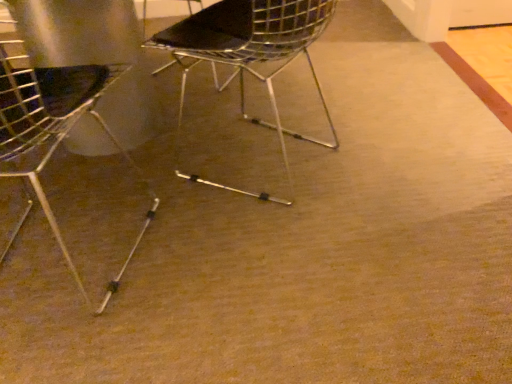
Question: In which direction should I rotate to look at metallic wire chair at center, the 1th chair from the right?

Choices:
 (A) left
 (B) right

Answer: (B)

Question: Does metallic wire chair at center, which is the second chair in left-to-right order, turn towards metallic wire chair at left, the first chair when ordered from left to right?

Choices:
 (A) yes
 (B) no

Answer: (B)

Question: Considering the relative sizes of metallic wire chair at center, which is the second chair in left-to-right order, and metallic wire chair at left, the second chair positioned from the right, in the image provided, is metallic wire chair at center, which is the second chair in left-to-right order, shorter than metallic wire chair at left, the second chair positioned from the right,?

Choices:
 (A) yes
 (B) no

Answer: (A)

Question: Is metallic wire chair at center, which is the second chair in left-to-right order, in front of metallic wire chair at left, the second chair positioned from the right?

Choices:
 (A) yes
 (B) no

Answer: (B)

Question: From a real-world perspective, is metallic wire chair at center, the 1th chair from the right, on metallic wire chair at left, the second chair positioned from the right?

Choices:
 (A) no
 (B) yes

Answer: (A)

Question: Can you confirm if metallic wire chair at center, which is the second chair in left-to-right order, is positioned to the right of metallic wire chair at left, the second chair positioned from the right?

Choices:
 (A) no
 (B) yes

Answer: (B)

Question: Considering the relative sizes of metallic wire chair at center, which is the second chair in left-to-right order, and metallic wire chair at left, the second chair positioned from the right, in the image provided, is metallic wire chair at center, which is the second chair in left-to-right order, bigger than metallic wire chair at left, the second chair positioned from the right,?

Choices:
 (A) no
 (B) yes

Answer: (A)

Question: Is metallic wire chair at left, the first chair when ordered from left to right, bigger than metallic wire chair at center, the 1th chair from the right?

Choices:
 (A) yes
 (B) no

Answer: (A)

Question: Could you tell me if metallic wire chair at left, the second chair positioned from the right, is facing metallic wire chair at center, the 1th chair from the right?

Choices:
 (A) no
 (B) yes

Answer: (A)

Question: From a real-world perspective, is metallic wire chair at left, the second chair positioned from the right, on top of metallic wire chair at center, the 1th chair from the right?

Choices:
 (A) yes
 (B) no

Answer: (A)

Question: Is metallic wire chair at center, which is the second chair in left-to-right order, inside metallic wire chair at left, the second chair positioned from the right?

Choices:
 (A) yes
 (B) no

Answer: (B)

Question: Considering the relative sizes of metallic wire chair at left, the second chair positioned from the right, and metallic wire chair at center, which is the second chair in left-to-right order, in the image provided, is metallic wire chair at left, the second chair positioned from the right, wider than metallic wire chair at center, which is the second chair in left-to-right order,?

Choices:
 (A) yes
 (B) no

Answer: (B)

Question: Considering the relative positions of metallic wire chair at left, the second chair positioned from the right, and metallic wire chair at center, the 1th chair from the right, in the image provided, is metallic wire chair at left, the second chair positioned from the right, to the right of metallic wire chair at center, the 1th chair from the right, from the viewer's perspective?

Choices:
 (A) yes
 (B) no

Answer: (B)

Question: From a real-world perspective, is metallic wire chair at left, the second chair positioned from the right, above or below metallic wire chair at center, the 1th chair from the right?

Choices:
 (A) below
 (B) above

Answer: (B)